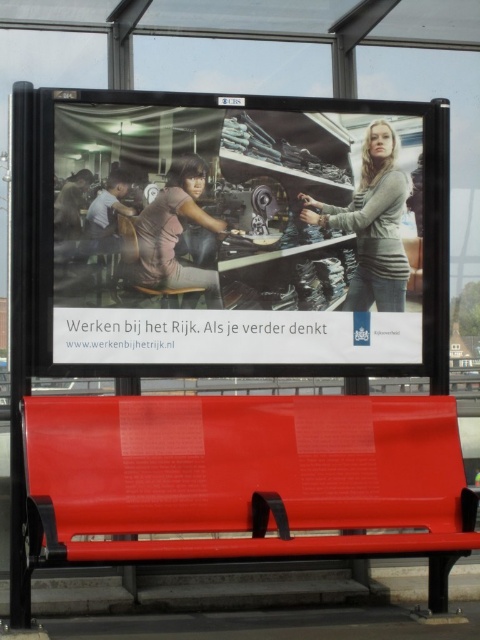
Question: Does matte black poster at center have a larger size compared to pink fabric shirt at center?

Choices:
 (A) no
 (B) yes

Answer: (B)

Question: Considering the real-world distances, which object is closest to the matte gray shirt at center?

Choices:
 (A) metallic red bench at center
 (B) gray sweater at center

Answer: (B)

Question: Based on their relative distances, which object is farther from the metallic red bench at center?

Choices:
 (A) pink fabric shirt at center
 (B) gray sweater at center
 (C) matte black poster at center

Answer: (B)

Question: Is metallic red bench at center to the right of matte gray shirt at center from the viewer's perspective?

Choices:
 (A) no
 (B) yes

Answer: (B)

Question: Among these objects, which one is nearest to the camera?

Choices:
 (A) metallic red bench at center
 (B) matte black poster at center

Answer: (A)

Question: Can you confirm if gray sweater at center is positioned to the right of pink fabric shirt at center?

Choices:
 (A) no
 (B) yes

Answer: (B)